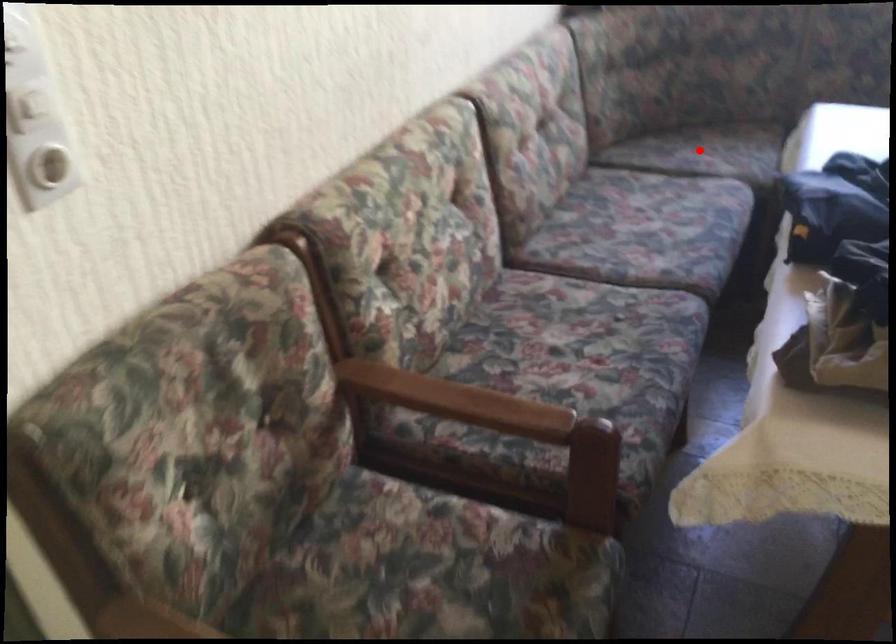
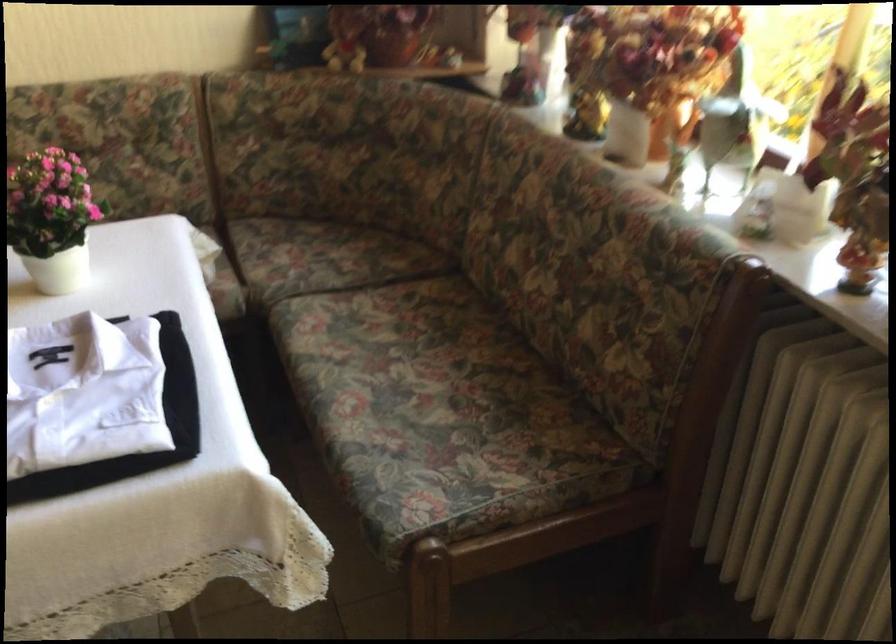
In the second image, find the point that corresponds to the highlighted location in the first image.

(306, 252)